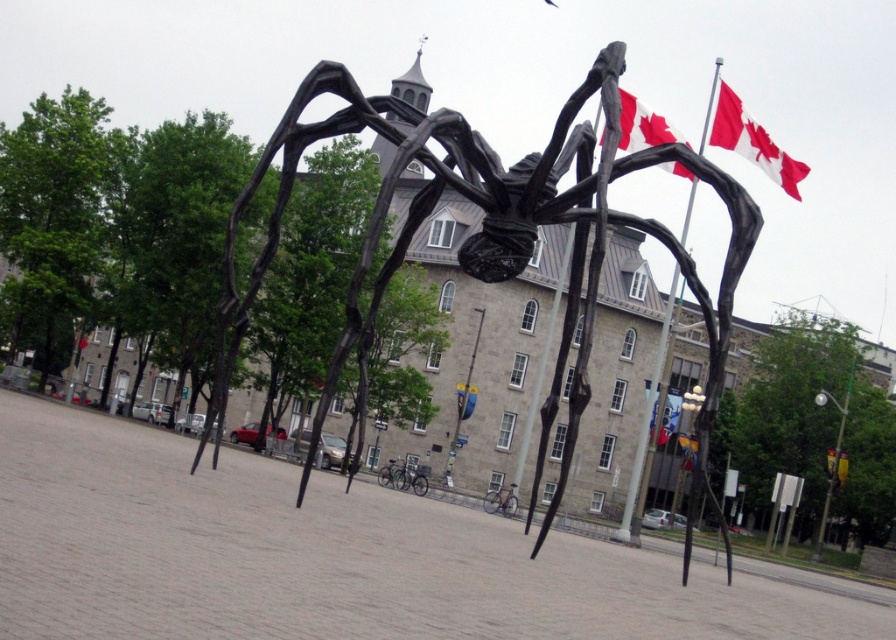
Question: Is the position of red/white fabric flag at upper right more distant than that of red fabric flag at center?

Choices:
 (A) yes
 (B) no

Answer: (B)

Question: Among these objects, which one is nearest to the camera?

Choices:
 (A) red/white fabric flag at upper right
 (B) red fabric flag at center

Answer: (A)

Question: In this image, where is black matte spider at center located relative to red fabric flag at upper right?

Choices:
 (A) left
 (B) right

Answer: (A)

Question: Is black matte spider at center closer to camera compared to red fabric flag at upper right?

Choices:
 (A) no
 (B) yes

Answer: (B)

Question: Which is farther from the red fabric flag at center?

Choices:
 (A) red/white fabric flag at upper right
 (B) black matte spider at center
 (C) red fabric flag at upper right

Answer: (C)

Question: Which point is closer to the camera?

Choices:
 (A) black matte spider at center
 (B) red fabric flag at upper right

Answer: (A)